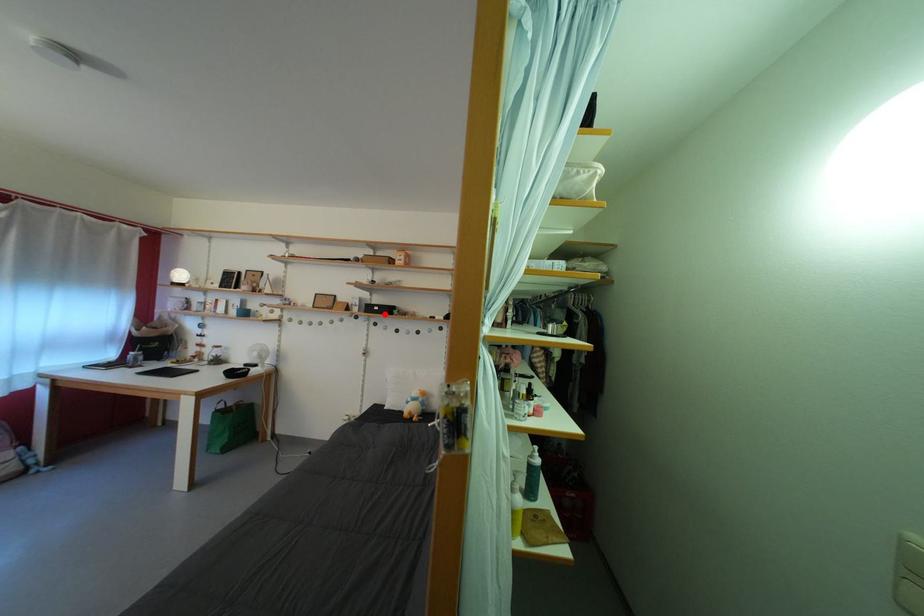
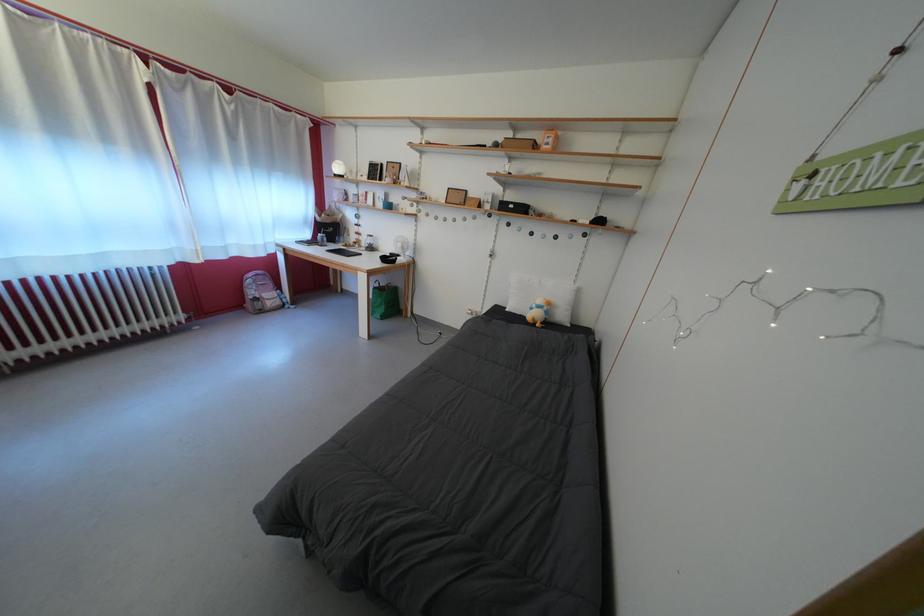
Where in the second image is the point corresponding to the highlighted location from the first image?

(519, 213)